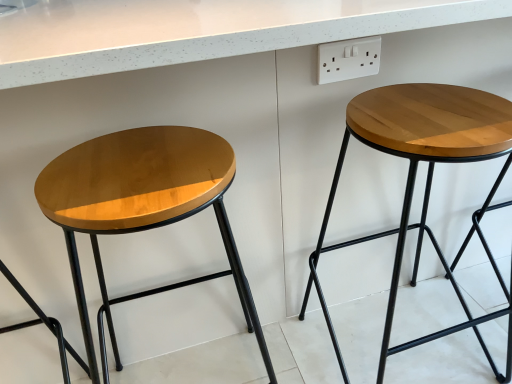
Where is `empty space that is ontop of glossy wood stool at left, positioned as the second stool in right-to-left order (from a real-world perspective)`? empty space that is ontop of glossy wood stool at left, positioned as the second stool in right-to-left order (from a real-world perspective) is located at coordinates (130, 170).